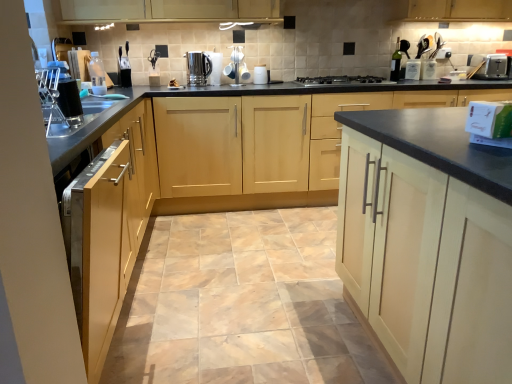
Question: Can you confirm if light wood cabinet at center, placed as the second cabinetry when sorted from left to right, is shorter than metallic silver toaster at upper right, positioned as the first appliance in back-to-front order?

Choices:
 (A) no
 (B) yes

Answer: (A)

Question: Does light wood cabinet at center, which is the 2th cabinetry from right to left, appear on the right side of metallic silver toaster at upper right, the 2th appliance viewed from the front?

Choices:
 (A) yes
 (B) no

Answer: (B)

Question: Is light wood cabinet at center, which is the 2th cabinetry from right to left, to the left of metallic silver toaster at upper right, positioned as the first appliance in back-to-front order, from the viewer's perspective?

Choices:
 (A) no
 (B) yes

Answer: (B)

Question: Are light wood cabinet at center, which is the 2th cabinetry from right to left, and metallic silver toaster at upper right, arranged as the 2th appliance when viewed from the left, beside each other?

Choices:
 (A) yes
 (B) no

Answer: (B)

Question: Does light wood cabinet at center, which is the 2th cabinetry from right to left, lie in front of metallic silver toaster at upper right, positioned as the first appliance in back-to-front order?

Choices:
 (A) yes
 (B) no

Answer: (A)

Question: Can you confirm if light wood cabinet at center, placed as the second cabinetry when sorted from left to right, is bigger than metallic silver toaster at upper right, the 2th appliance viewed from the front?

Choices:
 (A) yes
 (B) no

Answer: (A)

Question: Does green glass bottle at upper right, the second bottle from the front, lie behind transparent plastic bottle at upper left, the 2th bottle from the top?

Choices:
 (A) yes
 (B) no

Answer: (A)

Question: From the image's perspective, is green glass bottle at upper right, which is the second bottle in left-to-right order, on top of transparent plastic bottle at upper left, which is the second bottle from right to left?

Choices:
 (A) yes
 (B) no

Answer: (A)

Question: Are green glass bottle at upper right, which is the second bottle in left-to-right order, and transparent plastic bottle at upper left, the 2th bottle from the top, making contact?

Choices:
 (A) no
 (B) yes

Answer: (A)

Question: From the image's perspective, is green glass bottle at upper right, which is the 1th bottle from right to left, under transparent plastic bottle at upper left, the 2th bottle from the top?

Choices:
 (A) no
 (B) yes

Answer: (A)

Question: Could you tell me if green glass bottle at upper right, placed as the first bottle when sorted from back to front, is turned towards transparent plastic bottle at upper left, the 1th bottle from the left?

Choices:
 (A) no
 (B) yes

Answer: (A)

Question: Does green glass bottle at upper right, which is the 1th bottle from right to left, have a greater width compared to transparent plastic bottle at upper left, which is the second bottle from right to left?

Choices:
 (A) yes
 (B) no

Answer: (B)

Question: Is black matte gas stove at center smaller than satin silver kettle at center?

Choices:
 (A) yes
 (B) no

Answer: (B)